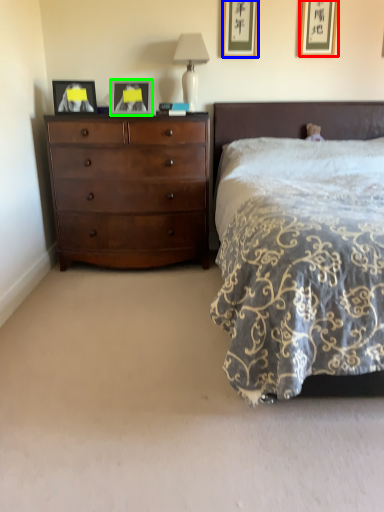
Question: Which is farther away from picture frame (highlighted by a red box)? picture frame (highlighted by a blue box) or picture frame (highlighted by a green box)?

Choices:
 (A) picture frame
 (B) picture frame

Answer: (B)